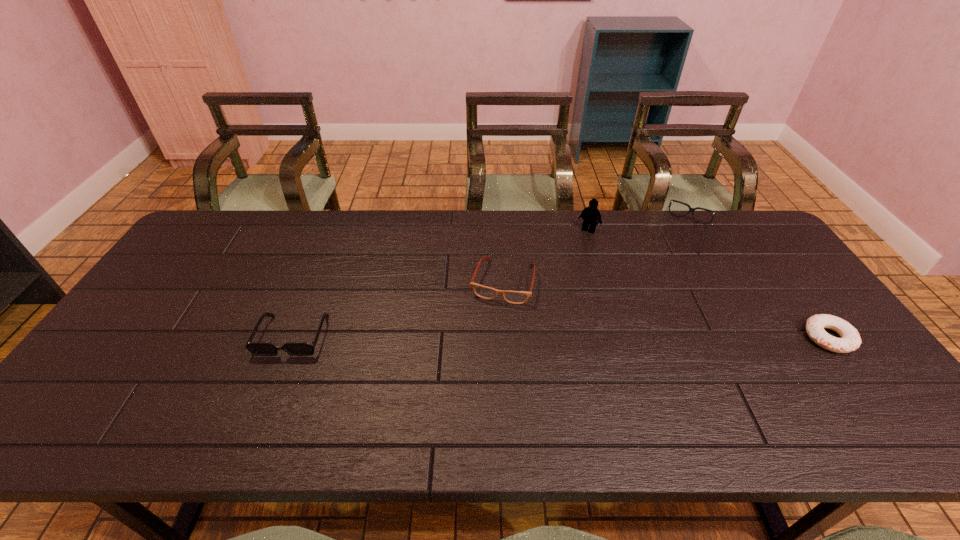
Find the location of a particular element. The width and height of the screenshot is (960, 540). Lego that is at the far edge is located at coordinates (590, 214).

Locate an element on the screen. spectacles that is at the far edge is located at coordinates (692, 210).

The width and height of the screenshot is (960, 540). I want to click on doughnut that is at the right edge, so click(x=850, y=340).

This screenshot has height=540, width=960. Find the location of `spectacles that is at the right edge`. spectacles that is at the right edge is located at coordinates (692, 210).

This screenshot has height=540, width=960. Find the location of `object positioned at the far right corner`. object positioned at the far right corner is located at coordinates (692, 210).

Locate an element on the screen. Image resolution: width=960 pixels, height=540 pixels. free space at the far edge of the desktop is located at coordinates (324, 244).

In the image, there is a desktop. At what (x,y) coordinates should I click in order to perform the action: click on vacant space at the near edge. Please return your answer as a coordinate pair (x, y). Image resolution: width=960 pixels, height=540 pixels. Looking at the image, I should click on (648, 375).

Identify the location of free space at the right edge of the desktop. (740, 269).

Where is `free point at the near right corner`? free point at the near right corner is located at coordinates (830, 395).

You are a GUI agent. You are given a task and a screenshot of the screen. Output one action in this format:
    pyautogui.click(x=<x>, y=<y>)
    Task: Click on the vacant point located between the third object from left to right and the left spectacles
    The width and height of the screenshot is (960, 540).
    Given the screenshot: What is the action you would take?
    pyautogui.click(x=545, y=255)